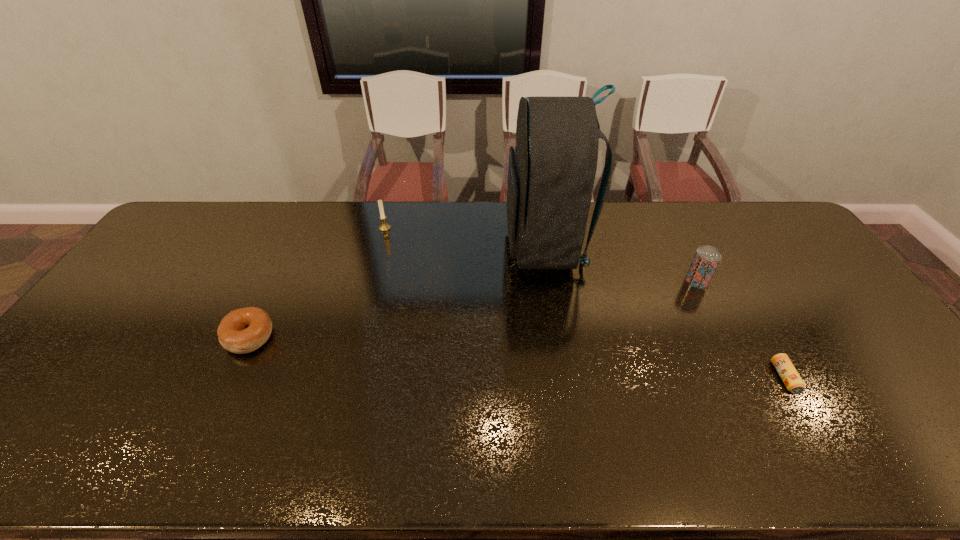
Identify the location of the second closest object to the shortest object. This screenshot has height=540, width=960. (551, 173).

Where is `object that is the closest to the fourth farthest object`? The width and height of the screenshot is (960, 540). object that is the closest to the fourth farthest object is located at coordinates (384, 227).

The image size is (960, 540). What are the coordinates of `vacant region that satisfies the following two spatial constraints: 1. on the front-facing side of the farther beer can; 2. on the left side of the third object from left to right` in the screenshot? It's located at (551, 281).

Find the location of a particular element. free location that satisfies the following two spatial constraints: 1. on the front-facing side of the backpack; 2. on the front side of the second nearest object is located at coordinates (560, 337).

Locate an element on the screen. This screenshot has width=960, height=540. vacant region that satisfies the following two spatial constraints: 1. on the front-facing side of the farther beer can; 2. on the left side of the backpack is located at coordinates (551, 281).